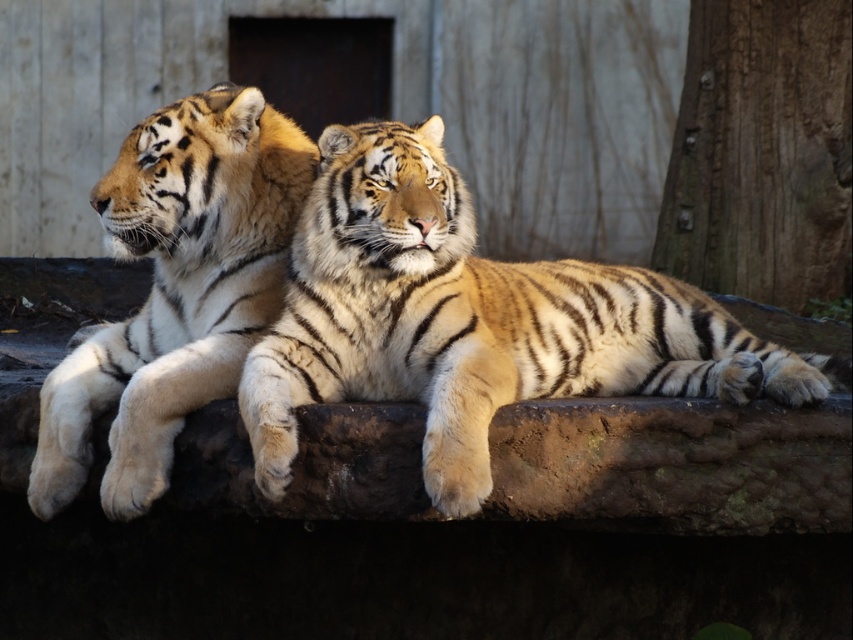
You are a wildlife photographer observing the golden fur tiger at left and the smooth bark tree trunk at right. Based on their sizes, which one would cast a longer shadow if the sun is directly overhead?

The golden fur tiger at left is much taller than the smooth bark tree trunk at right, so its shadow would be longer.

You are a wildlife photographer aiming to capture a closeup shot of the golden fur tiger at center without the smooth bark tree trunk at right appearing in the background. Based on their positions, is this possible?

The golden fur tiger at center is in front of the smooth bark tree trunk at right, so it is possible to capture a closeup shot of the golden fur tiger at center without the smooth bark tree trunk at right appearing in the background by focusing on the tiger and ensuring the trunk is out of frame.